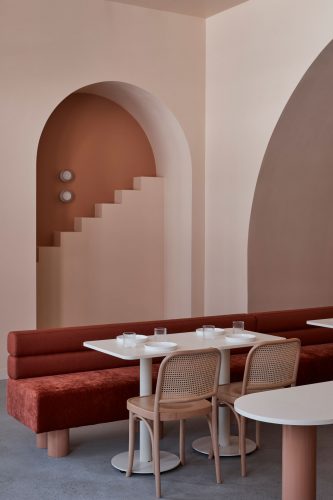
The width and height of the screenshot is (333, 500). What are the coordinates of `counter` in the screenshot? It's located at (293, 454).